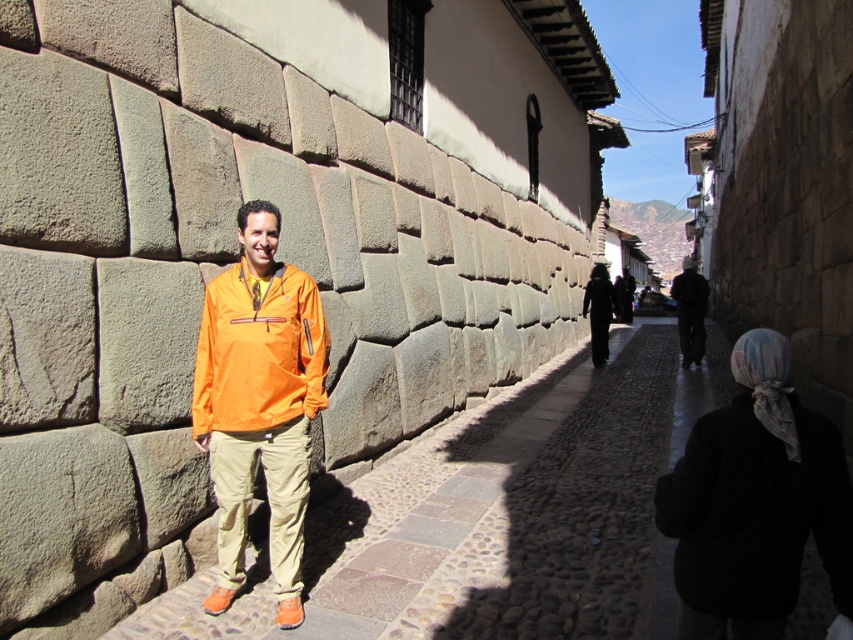
You are a tourist standing on the cobblestone pavement at center and want to take a photo of the orange fabric jacket at center. Since the jacket is above you, where should you position yourself to capture it in the frame?

The cobblestone pavement at center is below the orange fabric jacket at center, so you should position yourself lower or look upwards to capture the jacket in your photo.

You are a delivery person needing to place a small package between the black fabric headscarf at lower right and the matte orange jacket at center. Can you fit the package in the space between them if the package requires 4 meters of space?

The distance between the black fabric headscarf at lower right and the matte orange jacket at center is 3.76 meters, which is less than the required 4 meters. Therefore, the package cannot be placed in that space.

You are standing at point (263, 266) and want to walk to point (683, 541). Given the street scene described, will you have to walk towards or away from the man in the bright orange jacket?

Point (683, 541) is in front of point (263, 266). Since the man is standing against the wall in the foreground, moving towards point (683, 541) would mean walking away from the man as the point is further away from the viewer.